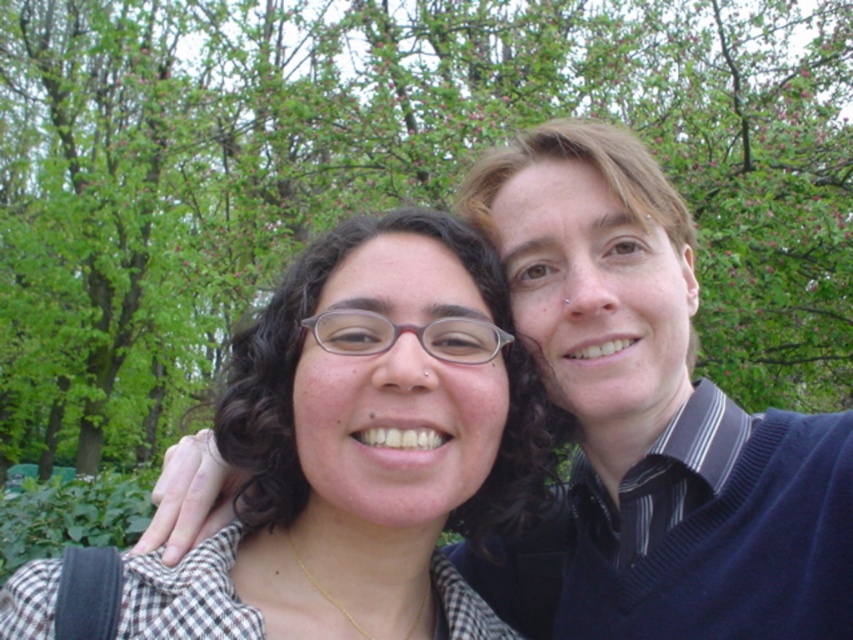
You are a photographer adjusting the camera focus. You need to ensure both the matte checkered shirt at center and the blue sweater at upper right are in focus. Given their heights, which one should you focus on first to maximize the depth of field?

The matte checkered shirt at center has a lesser height compared to the blue sweater at upper right. To maximize depth of field, focus on the matte checkered shirt at center first as it is closer to the camera.

You are a photographer standing at a certain distance from the matte checkered shirt at center. You want to take a closeup shot of the shirt. Is the current distance sufficient for a clear closeup, considering typical camera lens requirements?

The matte checkered shirt at center and viewer are 35.86 inches apart from each other. A typical closeup requires a distance of at least 24 inches. Therefore, the current distance is sufficient for a clear closeup.

You are a photographer trying to adjust the lighting for a portrait. You notice the matte checkered shirt at center and the blue sweater at upper right. Which object is closer to the camera, and why?

The matte checkered shirt at center is closer to the camera because it is positioned in front of the blue sweater at upper right.